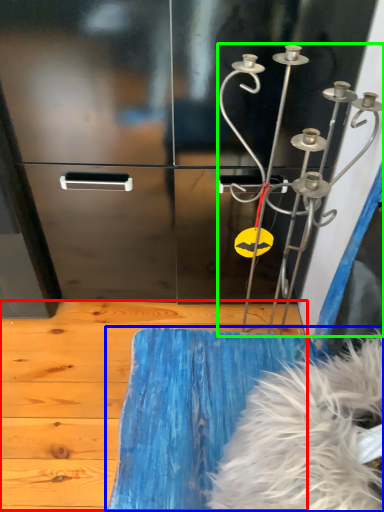
Question: Which is farther away from plywood (highlighted by a red box)? furniture (highlighted by a blue box) or wind chime (highlighted by a green box)?

Choices:
 (A) furniture
 (B) wind chime

Answer: (B)